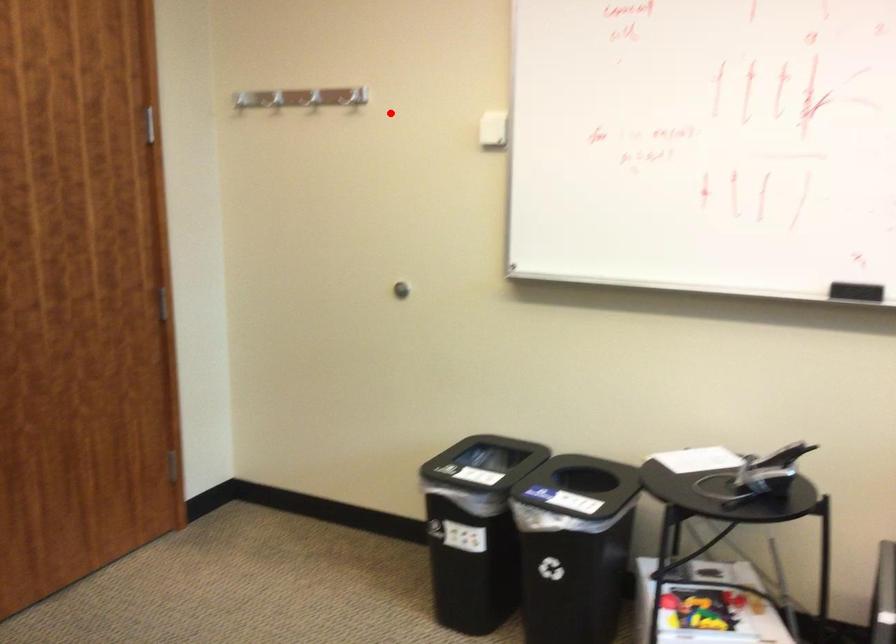
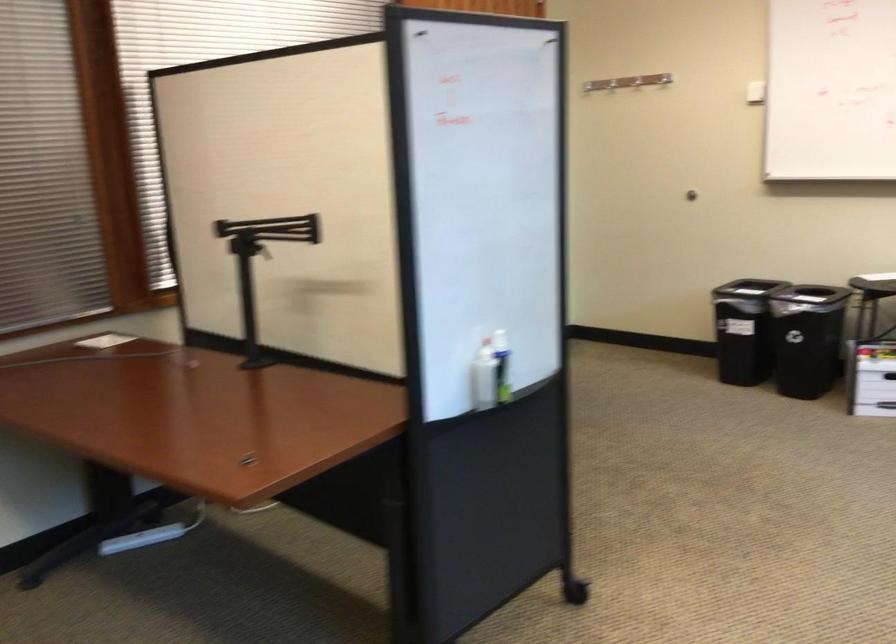
Question: I am providing you with two images of the same scene from different viewpoints. Image1 has a red point marked. In image2, the corresponding 3D location appears at what relative position? Reply with the corresponding letter.

Choices:
 (A) Closer
 (B) Farther

Answer: (B)